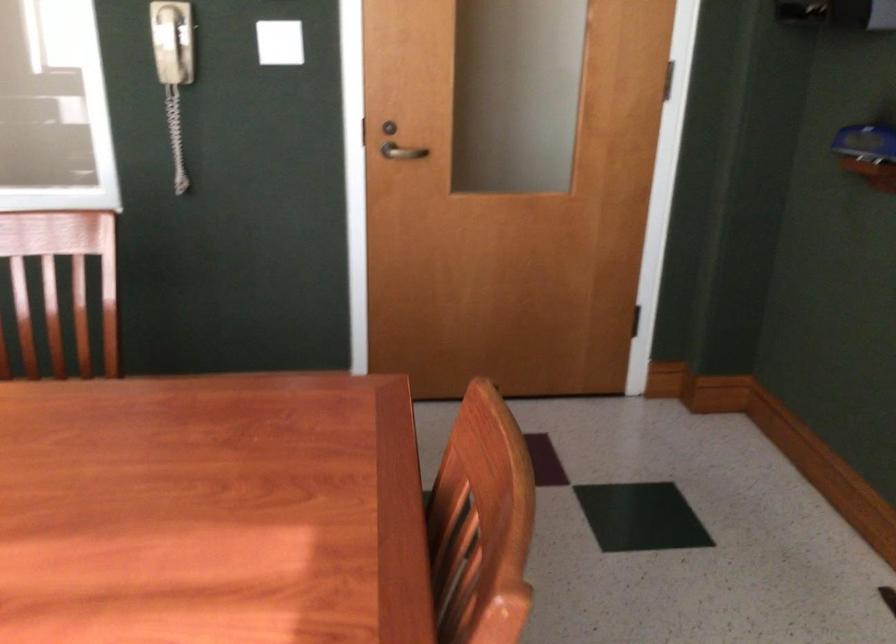
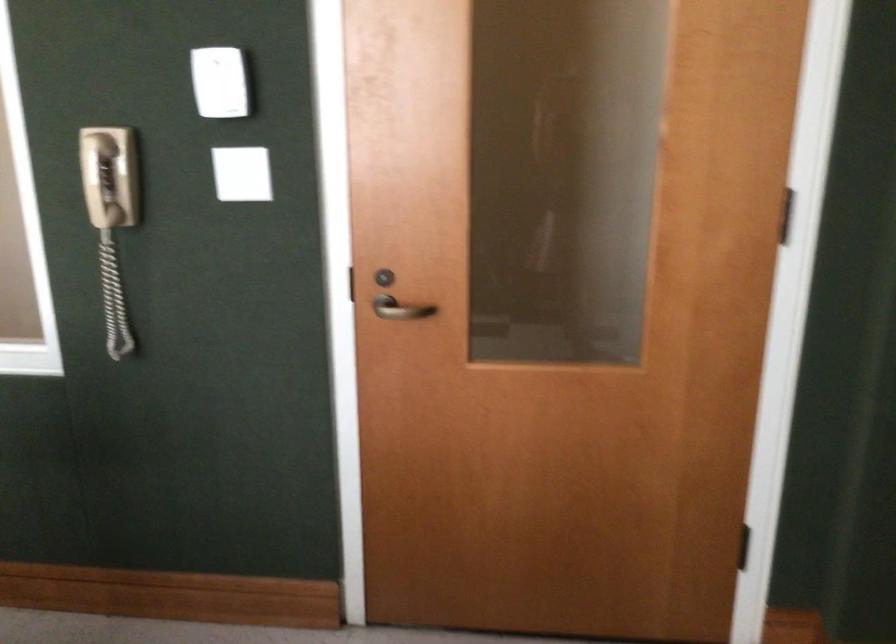
Question: The camera is either moving clockwise (left) or counter-clockwise (right) around the object. The first image is from the beginning of the video and the second image is from the end. Is the camera moving left or right when shooting the video?

Choices:
 (A) Left
 (B) Right

Answer: (B)